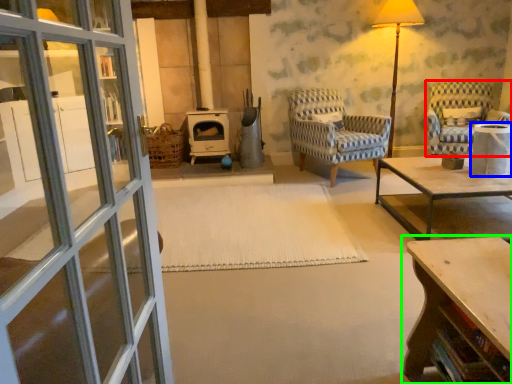
Question: Considering the real-world distances, which object is farthest from chair (highlighted by a red box)? side table (highlighted by a blue box) or table (highlighted by a green box)?

Choices:
 (A) side table
 (B) table

Answer: (B)